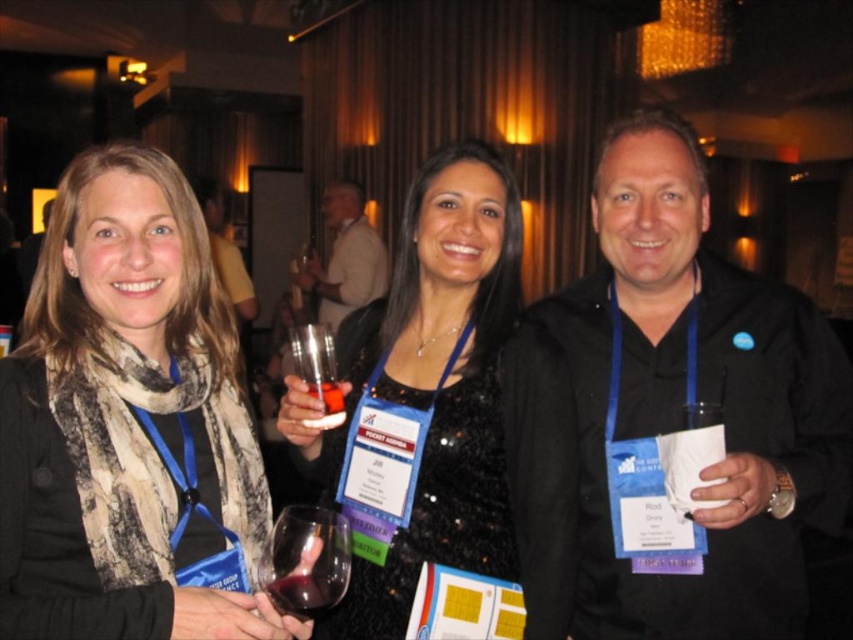
You are organizing a photo shoot and need to ensure that the matte black scarf at left and the dark red glass at center are visible in the frame. Given their sizes, which object should you prioritize positioning closer to the camera to maintain clarity?

The matte black scarf at left is wider than the dark red glass at center, so you should prioritize positioning the matte black scarf at left closer to the camera to maintain clarity.

You are at a conference and need to identify which object is higher between the matte black scarf at left and the dark red glass at center. Based on the scene, which one is taller?

The matte black scarf at left is taller than the dark red glass at center according to the description.